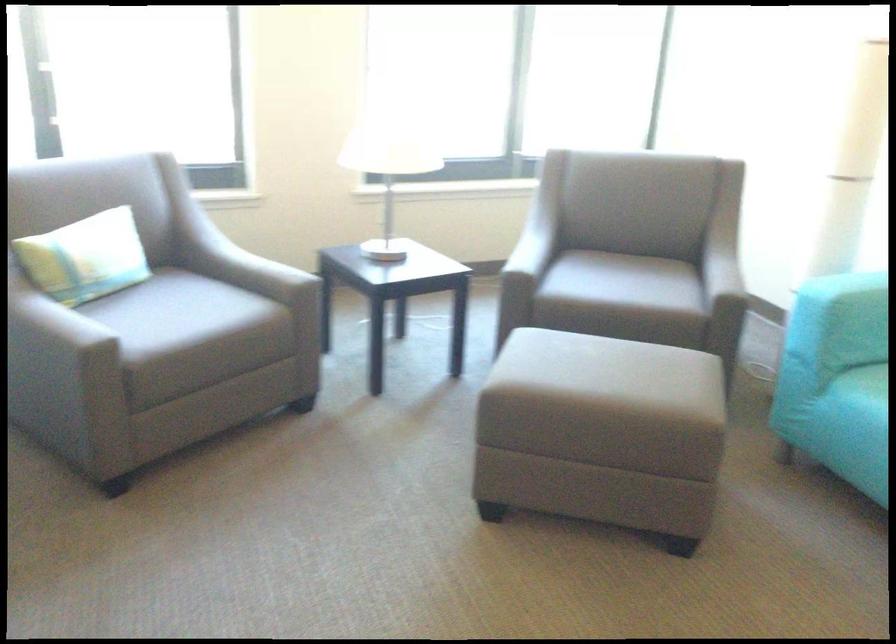
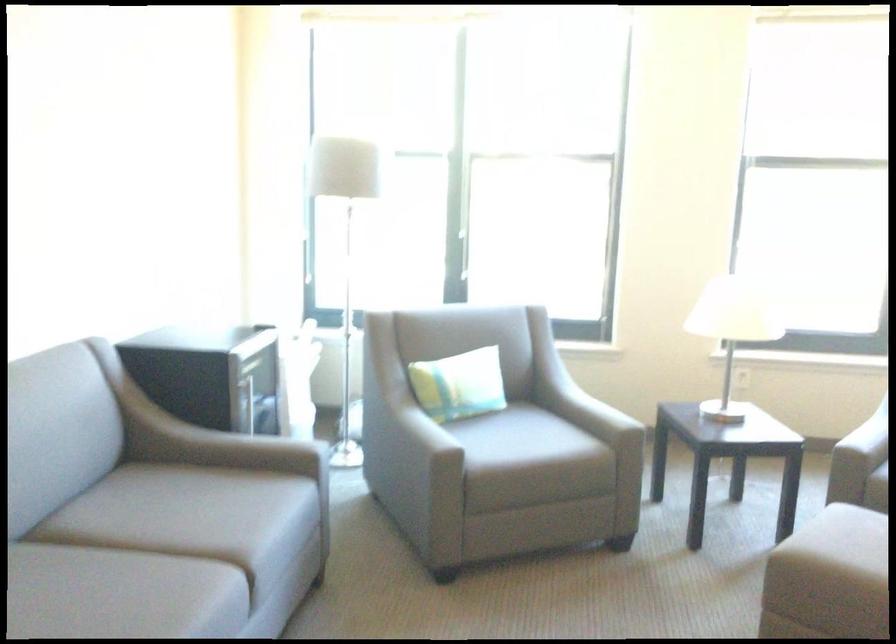
Where in the second image is the point corresponding to point 533,354 from the first image?

(849, 536)